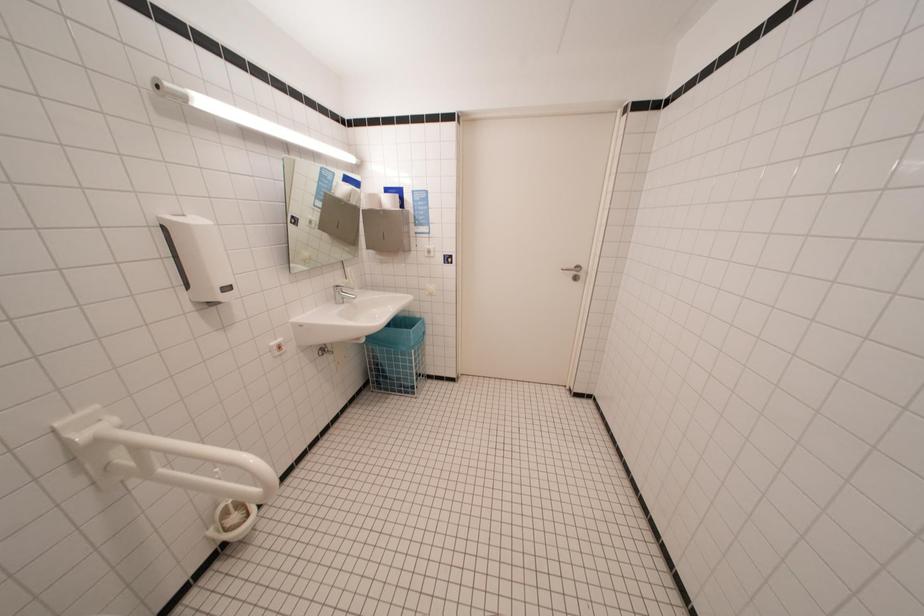
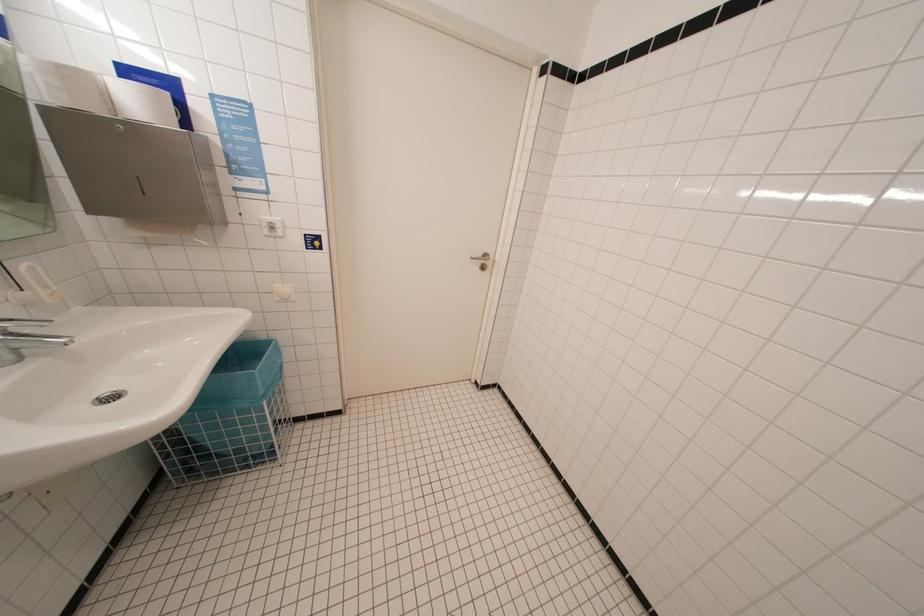
Question: How did the camera likely rotate?

Choices:
 (A) Left
 (B) Right
 (C) Up
 (D) Down

Answer: (B)